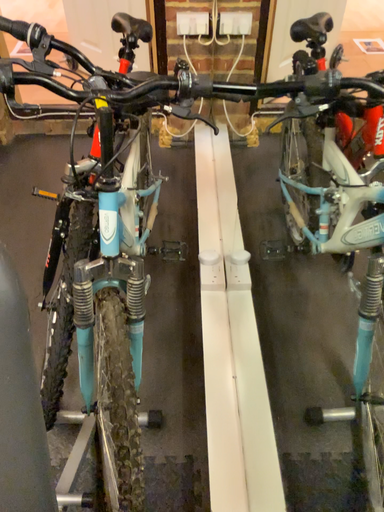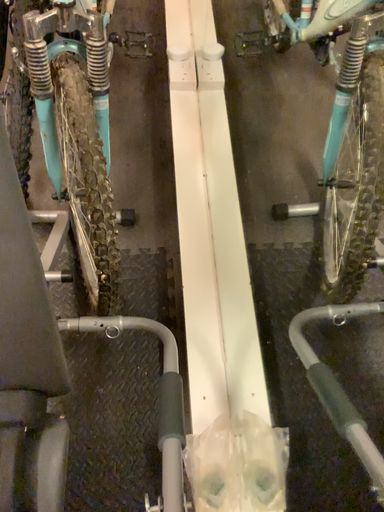
Question: Which way did the camera rotate in the video?

Choices:
 (A) rotated upward
 (B) rotated downward

Answer: (B)